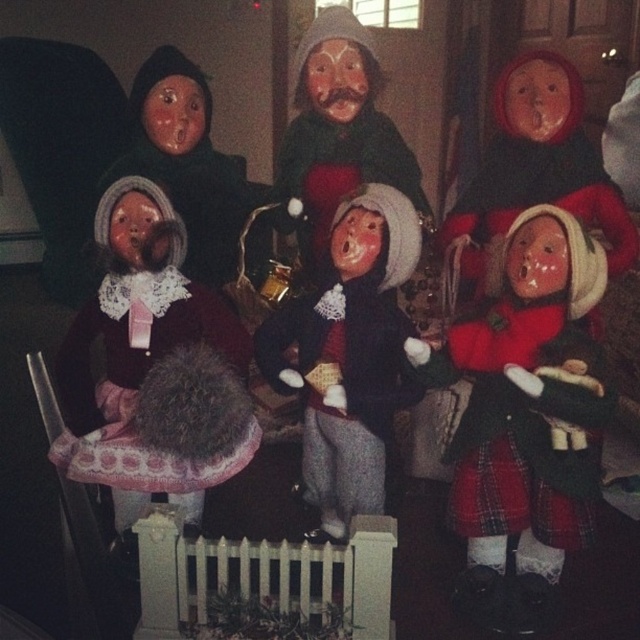
Question: Can you confirm if velvet maroon dress at left is positioned below matte black doll at center?

Choices:
 (A) no
 (B) yes

Answer: (A)

Question: In this image, where is red plaid skirt at center located relative to velvet maroon dress at left?

Choices:
 (A) below
 (B) above

Answer: (A)

Question: Can you confirm if red plaid skirt at center is bigger than matte black doll at center?

Choices:
 (A) yes
 (B) no

Answer: (B)

Question: Considering the real-world distances, which object is closest to the velvet maroon dress at left?

Choices:
 (A) red plaid skirt at center
 (B) matte black doll at center

Answer: (B)

Question: Which object appears closest to the camera in this image?

Choices:
 (A) red plaid skirt at center
 (B) matte black doll at center

Answer: (A)

Question: Which point is farther to the camera?

Choices:
 (A) (384, 230)
 (B) (556, 531)
 (C) (118, 257)

Answer: (A)